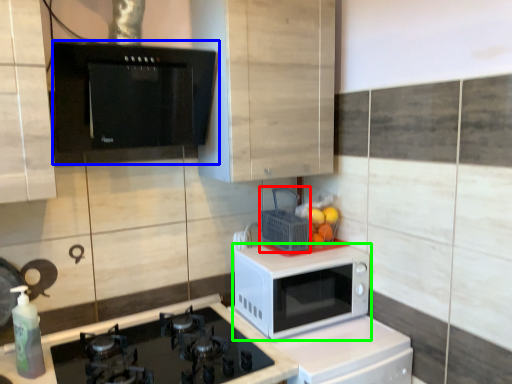
Question: Considering the real-world distances, which object is closest to basket (highlighted by a red box)? appliance (highlighted by a blue box) or microwave oven (highlighted by a green box).

Choices:
 (A) appliance
 (B) microwave oven

Answer: (B)